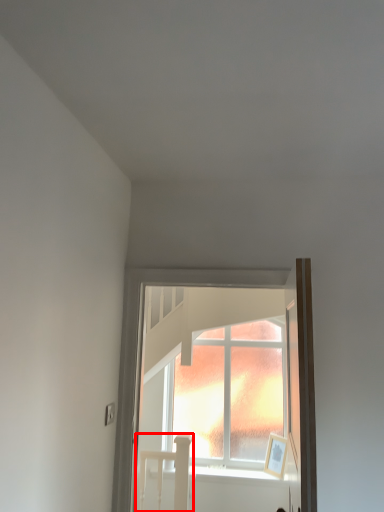
Question: From the image's perspective, where is bed (annotated by the red box) located relative to window?

Choices:
 (A) below
 (B) above

Answer: (A)